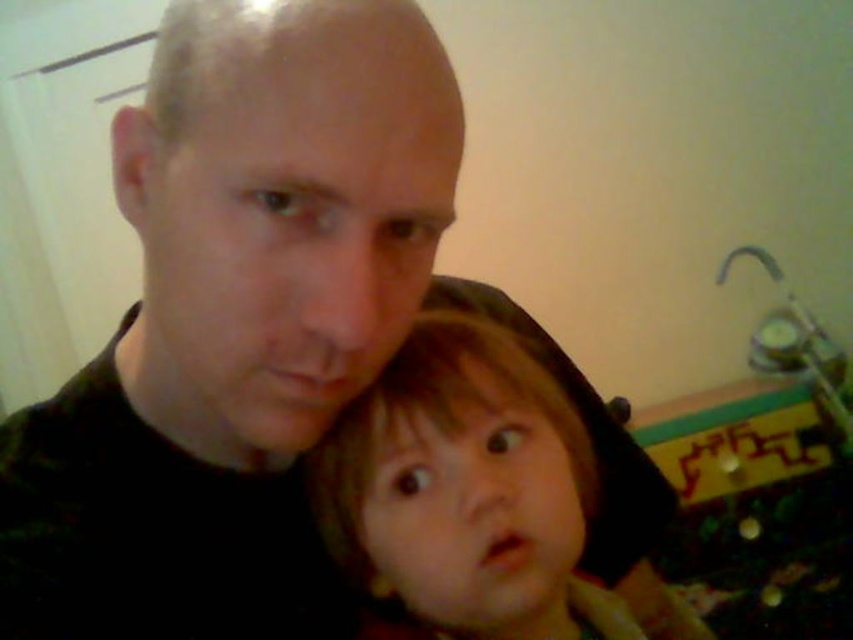
Question: Which object is closer to the camera taking this photo?

Choices:
 (A) smooth brown hair at center
 (B) black matte shirt at center

Answer: (B)

Question: Is black matte shirt at center wider than smooth brown hair at center?

Choices:
 (A) yes
 (B) no

Answer: (A)

Question: In this image, where is black matte shirt at center located relative to smooth brown hair at center?

Choices:
 (A) right
 (B) left

Answer: (B)

Question: Is black matte shirt at center further to camera compared to smooth brown hair at center?

Choices:
 (A) yes
 (B) no

Answer: (B)

Question: Among these objects, which one is nearest to the camera?

Choices:
 (A) smooth brown hair at center
 (B) black matte shirt at center

Answer: (B)